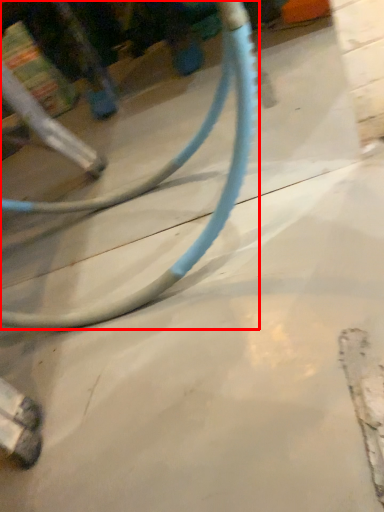
Question: From the image's perspective, what is the correct spatial relationship of bicycle wheel (annotated by the red box) in relation to concrete?

Choices:
 (A) below
 (B) above

Answer: (B)